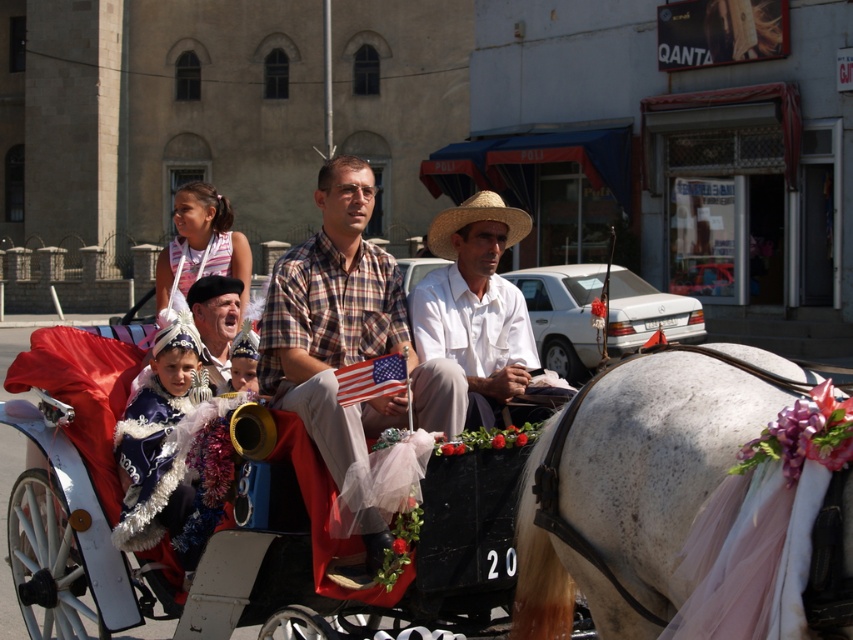
You are a photographer trying to capture a clear shot of the plaid fabric shirt at center and the matte black beret at center in the carriage. Based on their sizes, which one would appear larger in your photo?

The plaid fabric shirt at center is taller than the matte black beret at center, so it would appear larger in the photo.

Consider the image. You are a photographer standing in the street and want to take a photo of the two people in the carriage. You notice their clothing details. Which clothing item, the plaid fabric shirt at center or the matte black beret at center, is positioned more to the right side of the image?

The plaid fabric shirt at center is positioned to the right of the matte black beret at center, so the plaid fabric shirt at center is more to the right side of the image.

You are a photographer standing on the sidewalk. You want to take a photo of the white glossy horse at center and the white cotton shirt at center so that both are clearly visible. Based on their positions, which one should you focus on first to ensure it appears sharp in the photo?

The white glossy horse at center is in front of the white cotton shirt at center, so you should focus on the white glossy horse at center first to ensure it appears sharp. Since it is closer, focusing on it will keep both in focus if they are within the depth of field.